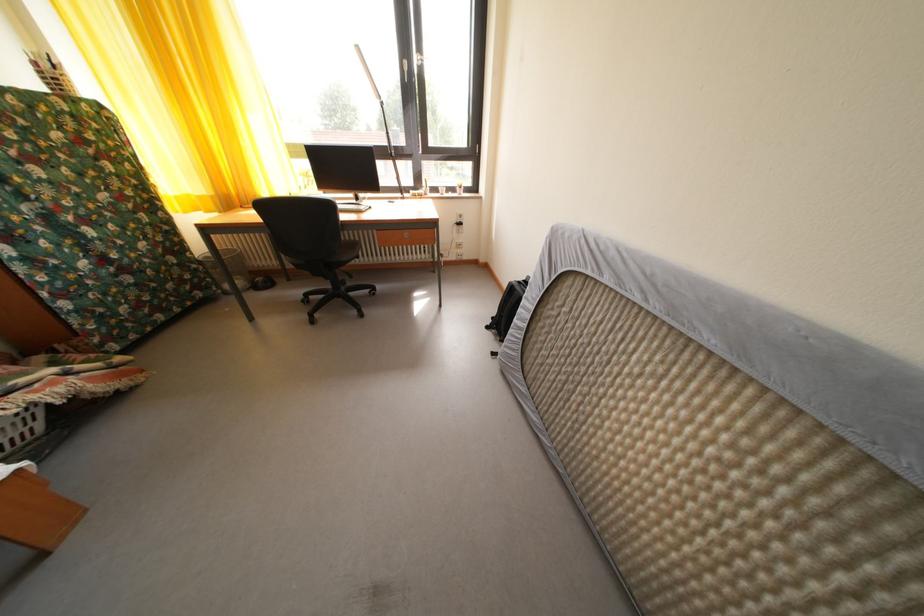
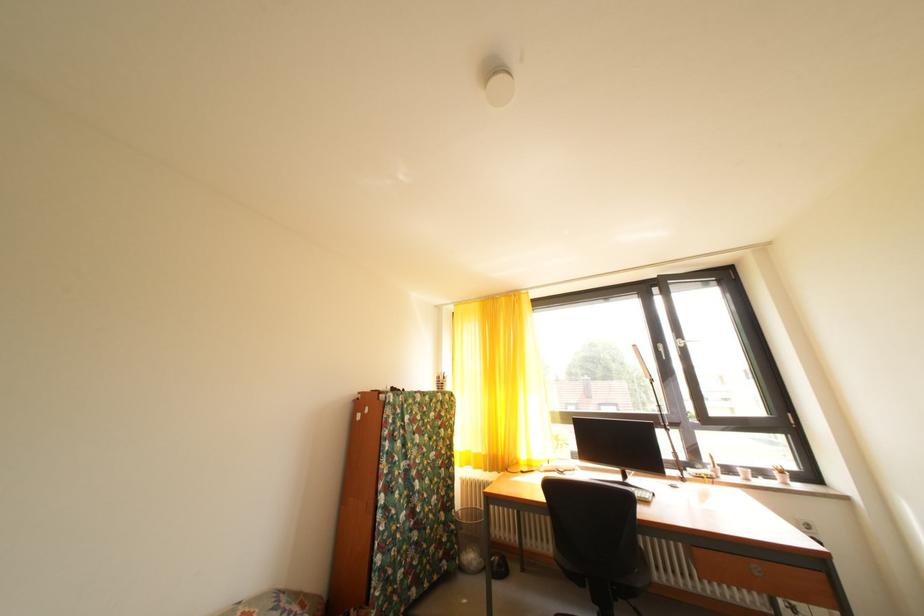
The point at (467, 195) is marked in the first image. Where is the corresponding point in the second image?

(784, 479)